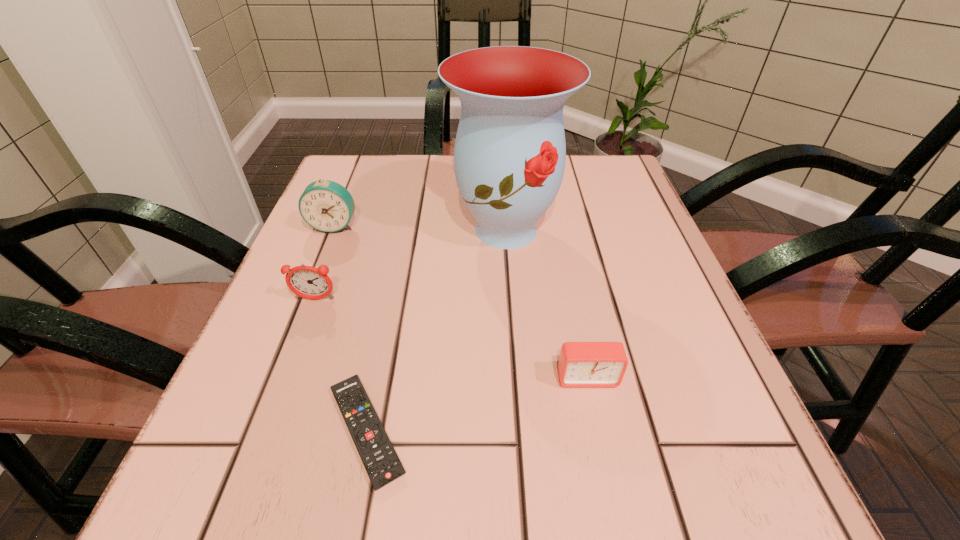
In order to click on free point that satisfies the following two spatial constraints: 1. on the front-facing side of the third farthest object; 2. on the left side of the third object from left to right in this screenshot , I will do pyautogui.click(x=265, y=430).

At what (x,y) coordinates should I click in order to perform the action: click on free spot that satisfies the following two spatial constraints: 1. on the front-facing side of the remote control; 2. on the right side of the tallest alarm clock. Please return your answer as a coordinate pair (x, y). Image resolution: width=960 pixels, height=540 pixels. Looking at the image, I should click on (252, 430).

Where is `vacant space that satisfies the following two spatial constraints: 1. on the front-facing side of the second nearest alarm clock; 2. on the left side of the shortest object`? The height and width of the screenshot is (540, 960). vacant space that satisfies the following two spatial constraints: 1. on the front-facing side of the second nearest alarm clock; 2. on the left side of the shortest object is located at coordinates (265, 430).

Locate an element on the screen. This screenshot has height=540, width=960. vacant space that satisfies the following two spatial constraints: 1. on the front-facing side of the tallest alarm clock; 2. on the right side of the third object from right to left is located at coordinates (252, 430).

Locate an element on the screen. vacant space that satisfies the following two spatial constraints: 1. on the front-facing side of the vase; 2. on the left side of the second tallest object is located at coordinates (332, 230).

The width and height of the screenshot is (960, 540). Find the location of `free point that satisfies the following two spatial constraints: 1. on the front-facing side of the third tallest object; 2. on the right side of the remote control`. free point that satisfies the following two spatial constraints: 1. on the front-facing side of the third tallest object; 2. on the right side of the remote control is located at coordinates (265, 430).